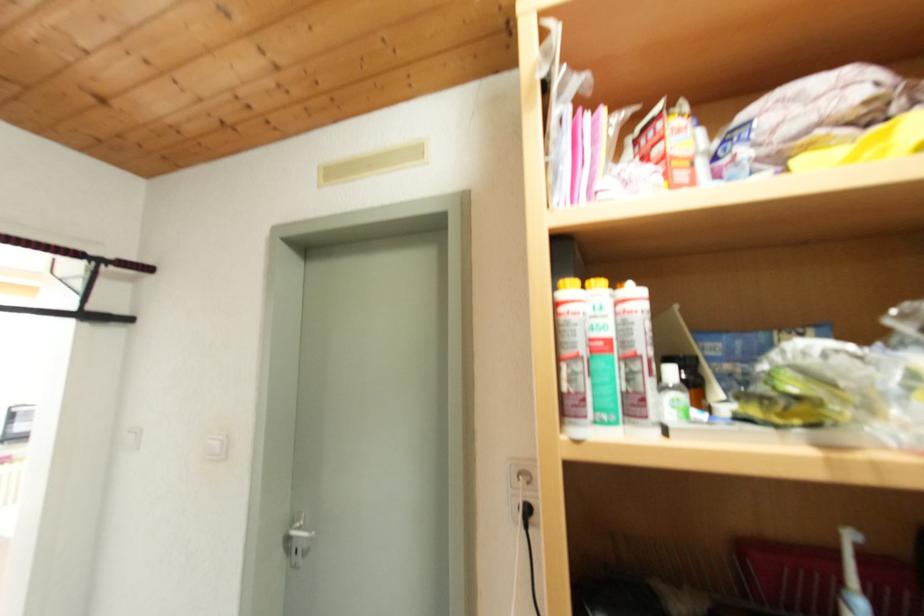
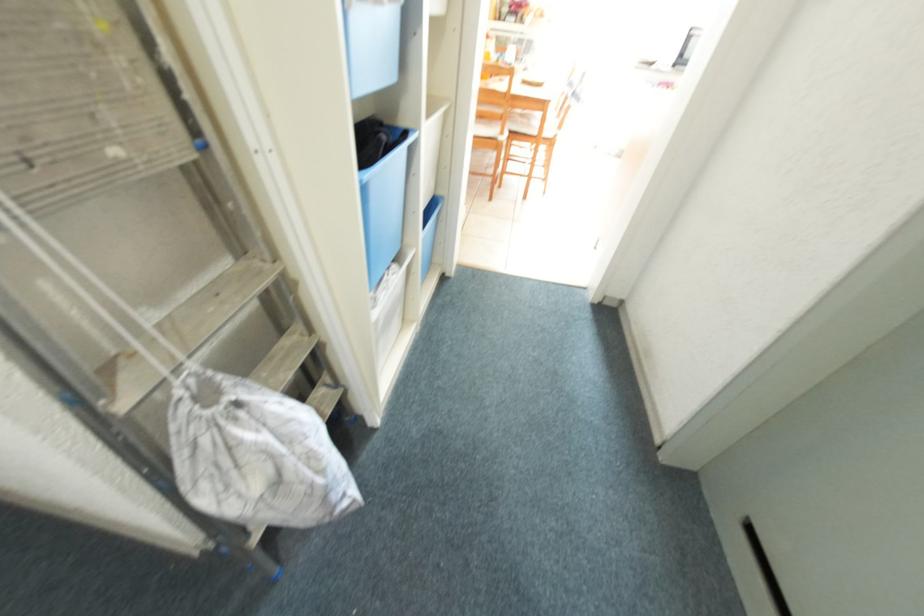
The first image is from the beginning of the video and the second image is from the end. How did the camera likely rotate when shooting the video?

The camera rotated toward left-down.